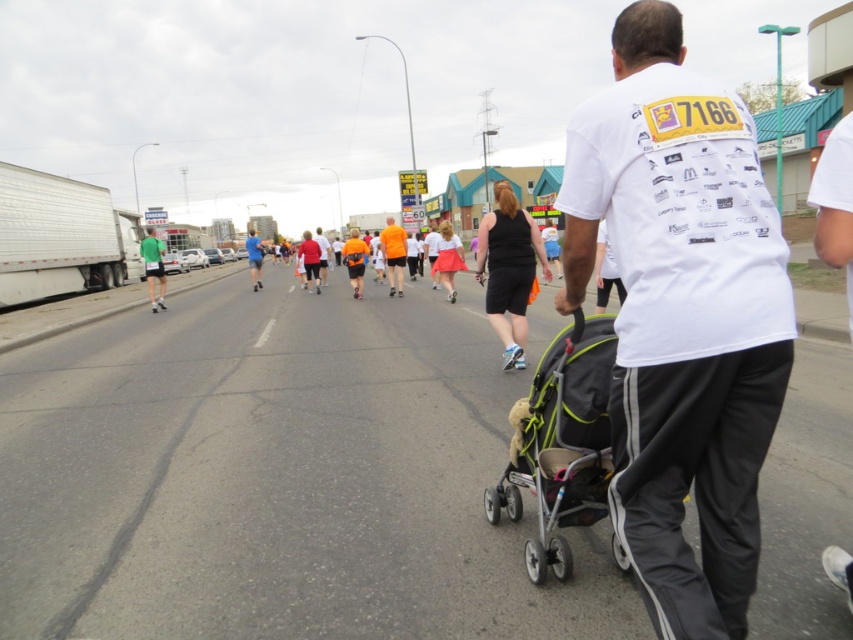
Is gray fabric stroller at center taller than black matte shorts at center?

No.

Is point (538, 467) more distant than point (502, 314)?

That is False.

From the picture: Who is more distant from viewer, (589,340) or (526,276)?

The point (526,276) is more distant.

I want to click on gray fabric stroller at center, so click(560, 444).

Is green fabric shorts at left positioned behind blue fabric shirt at center?

No, green fabric shorts at left is closer to the viewer.

Which is below, green fabric shorts at left or blue fabric shirt at center?

green fabric shorts at left is lower down.

Image resolution: width=853 pixels, height=640 pixels. I want to click on green fabric shorts at left, so click(x=154, y=266).

Which is behind, point (608, 438) or point (258, 284)?

Point (258, 284)

Is point (515, 477) more distant than point (251, 234)?

No, (515, 477) is in front of (251, 234).

Identify the location of gray fabric stroller at center. (560, 444).

Locate an element on the screen. gray fabric stroller at center is located at coordinates (560, 444).